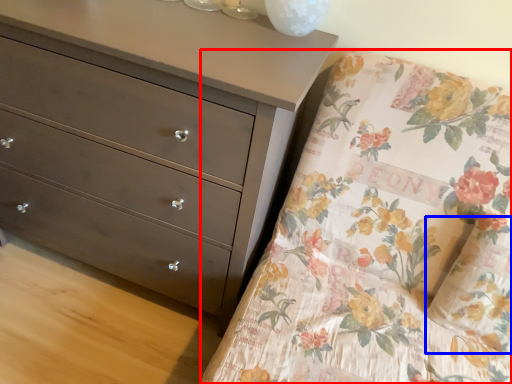
Question: Which point is closer to the camera, mattress (highlighted by a red box) or pillow (highlighted by a blue box)?

Choices:
 (A) mattress
 (B) pillow

Answer: (A)